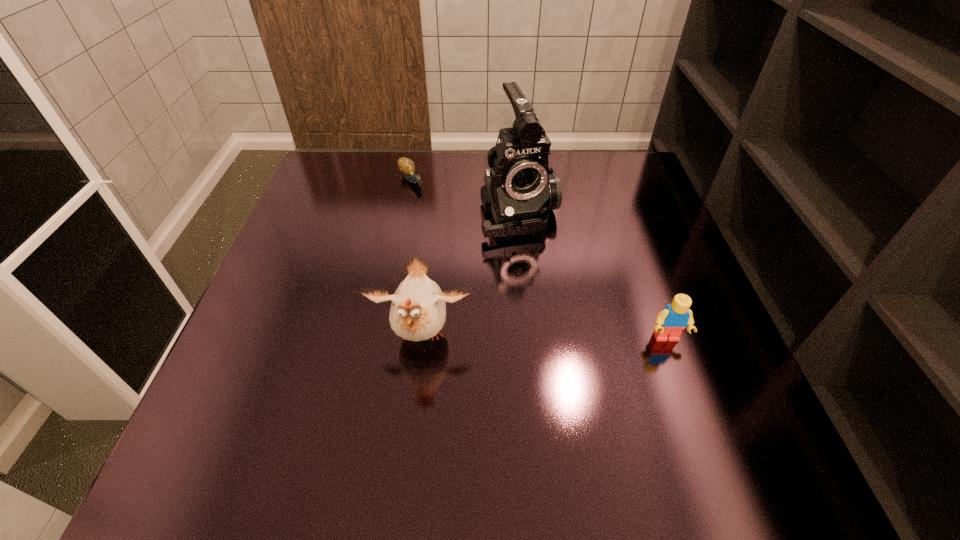
This screenshot has width=960, height=540. Identify the location of the second tallest object. (418, 311).

Where is `the third tallest object`? the third tallest object is located at coordinates (675, 317).

Image resolution: width=960 pixels, height=540 pixels. In order to click on the rightmost object in this screenshot , I will do `click(675, 317)`.

Find the location of a particular element. the shortest object is located at coordinates (407, 166).

I want to click on the tallest object, so click(520, 190).

Locate an element on the screen. The width and height of the screenshot is (960, 540). camcorder is located at coordinates (520, 190).

Locate an element on the screen. This screenshot has width=960, height=540. vacant space located 0.080m at the beak of the bird is located at coordinates (413, 414).

The width and height of the screenshot is (960, 540). I want to click on free spot located 0.120m on the front-facing side of the Lego, so click(690, 406).

Locate an element on the screen. The width and height of the screenshot is (960, 540). blank space located 0.090m on the front-facing side of the shortest object is located at coordinates (433, 207).

At what (x,y) coordinates should I click in order to perform the action: click on free spot located 0.390m on the front-facing side of the shortest object. Please return your answer as a coordinate pair (x, y). The height and width of the screenshot is (540, 960). Looking at the image, I should click on (497, 279).